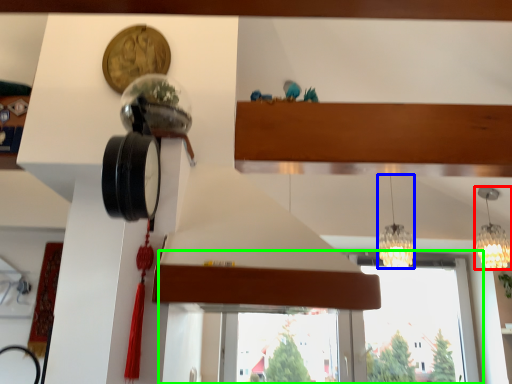
Question: Based on their relative distances, which object is farther from lamp (highlighted by a red box)? Choose from lamp (highlighted by a blue box) and window (highlighted by a green box).

Choices:
 (A) lamp
 (B) window

Answer: (B)